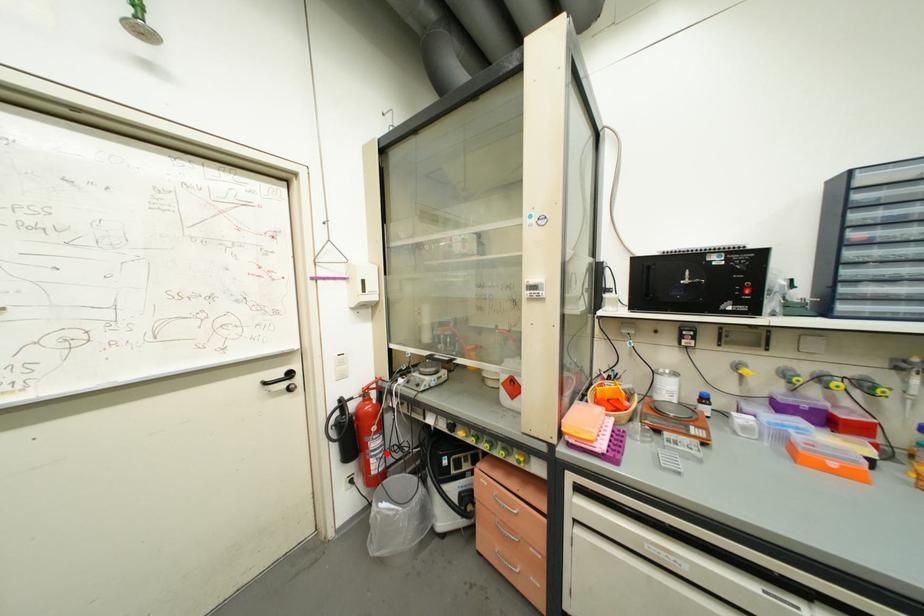
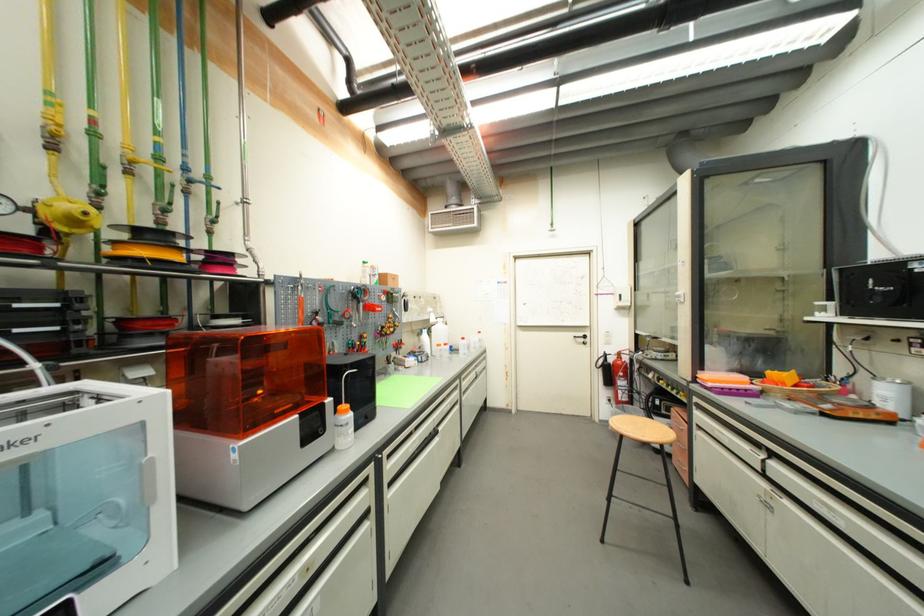
In the second image, find the point that corresponds to the highlighted location in the first image.

(630, 391)